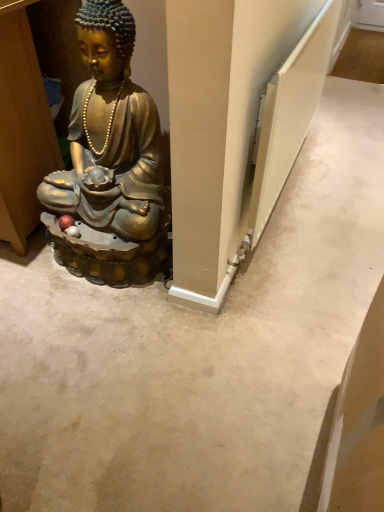
Question: Can we say gold metallic statue at left lies outside white textured radiator at right?

Choices:
 (A) yes
 (B) no

Answer: (A)

Question: Can you confirm if gold metallic statue at left is taller than white textured radiator at right?

Choices:
 (A) yes
 (B) no

Answer: (A)

Question: Is white textured radiator at right at the back of gold metallic statue at left?

Choices:
 (A) no
 (B) yes

Answer: (A)

Question: From a real-world perspective, is gold metallic statue at left under white textured radiator at right?

Choices:
 (A) yes
 (B) no

Answer: (A)

Question: Can you confirm if gold metallic statue at left is wider than white textured radiator at right?

Choices:
 (A) no
 (B) yes

Answer: (B)

Question: Considering the relative positions of gold metallic statue at left and white textured radiator at right in the image provided, is gold metallic statue at left in front of white textured radiator at right?

Choices:
 (A) no
 (B) yes

Answer: (B)

Question: Is white textured radiator at right not inside gold metallic statue at left?

Choices:
 (A) yes
 (B) no

Answer: (A)

Question: Is white textured radiator at right at the right side of gold metallic statue at left?

Choices:
 (A) yes
 (B) no

Answer: (A)

Question: Is white textured radiator at right not close to gold metallic statue at left?

Choices:
 (A) no
 (B) yes

Answer: (A)

Question: Can you confirm if white textured radiator at right is shorter than gold metallic statue at left?

Choices:
 (A) yes
 (B) no

Answer: (A)

Question: Is gold metallic statue at left completely or partially inside white textured radiator at right?

Choices:
 (A) no
 (B) yes

Answer: (A)

Question: Considering the relative sizes of white textured radiator at right and gold metallic statue at left in the image provided, is white textured radiator at right wider than gold metallic statue at left?

Choices:
 (A) yes
 (B) no

Answer: (B)

Question: Looking at their shapes, would you say white textured radiator at right is wider or thinner than gold metallic statue at left?

Choices:
 (A) wide
 (B) thin

Answer: (B)